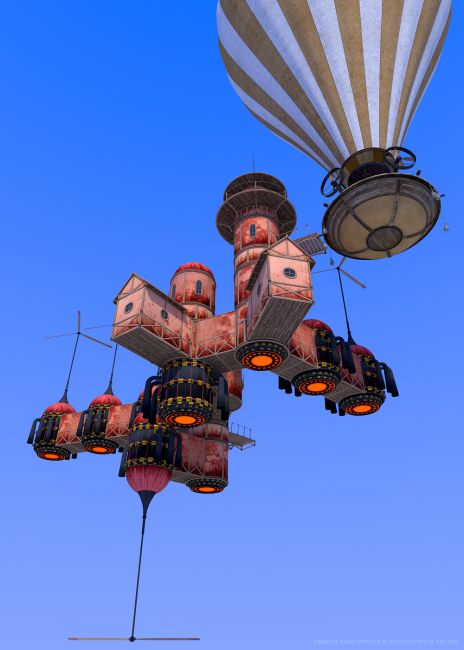
Identify the location of window. (195, 286), (125, 299), (281, 270), (165, 309), (247, 228), (251, 289).